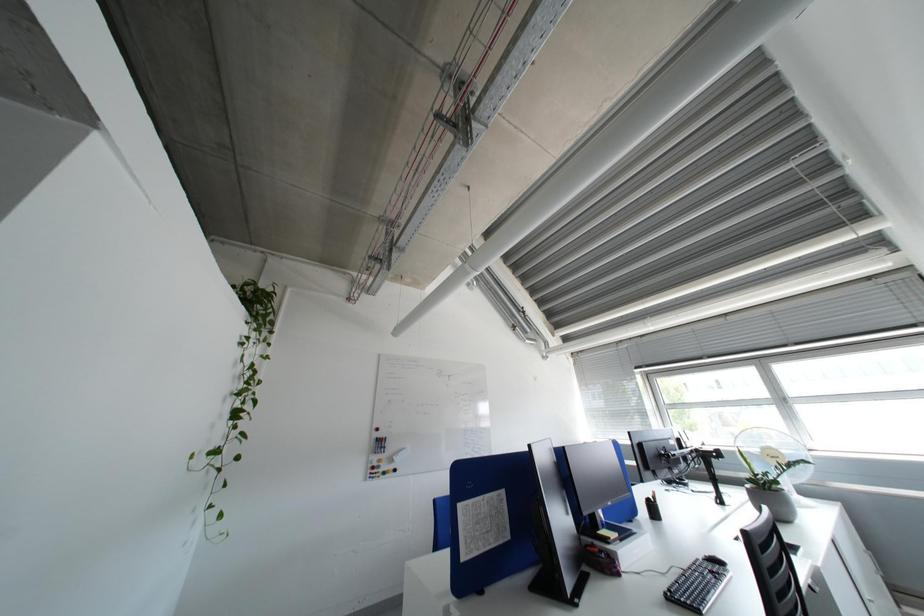
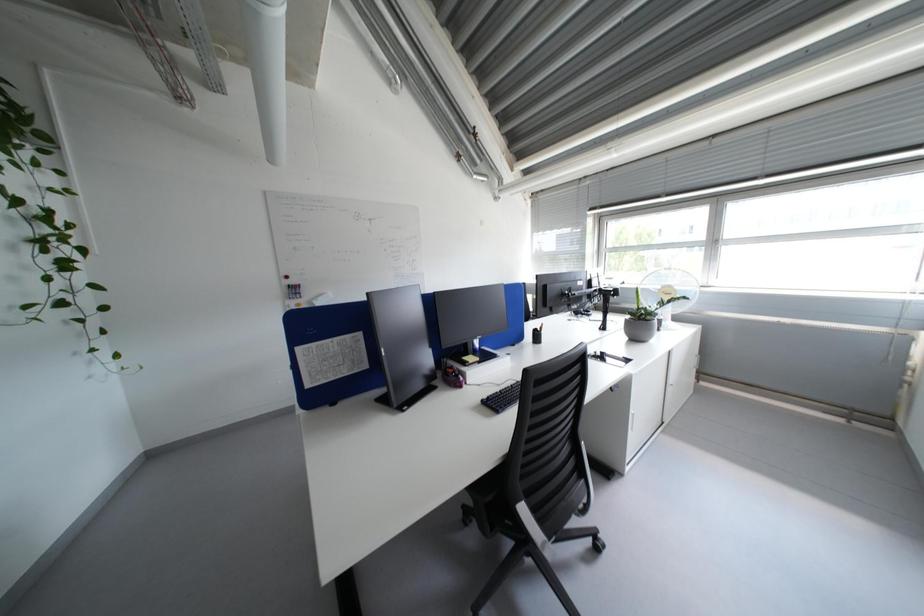
Question: Based on the continuous images, in which direction is the camera rotating? Reply with the corresponding letter.

Choices:
 (A) Left
 (B) Right
 (C) Up
 (D) Down

Answer: (D)